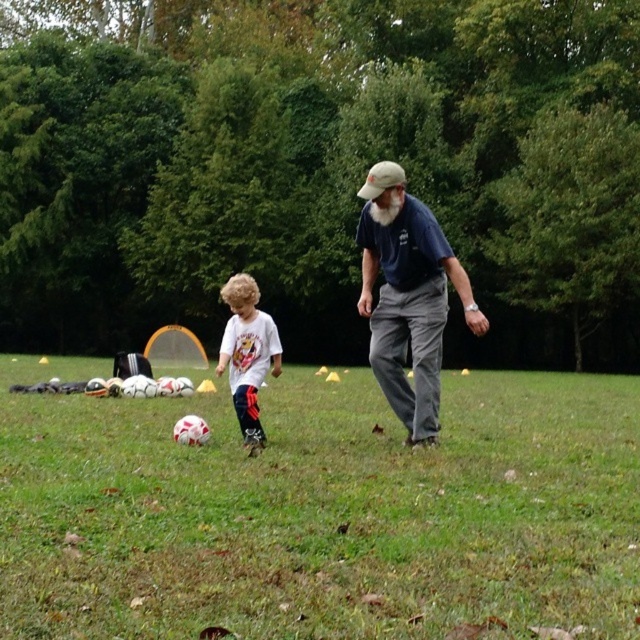
Is green grass at center closer to camera compared to dark blue shirt at center?

Yes, green grass at center is in front of dark blue shirt at center.

Is green grass at center positioned behind dark blue shirt at center?

No, it is not.

Looking at this image, who is more distant from viewer, (17, 358) or (417, 310)?

Positioned behind is point (17, 358).

The width and height of the screenshot is (640, 640). In order to click on green grass at center in this screenshot , I will do pyautogui.click(x=321, y=512).

Is dark blue shirt at center further to the viewer compared to white matte shirt at center?

No, dark blue shirt at center is in front of white matte shirt at center.

Is point (410, 344) behind point (243, 289)?

That is False.

I want to click on dark blue shirt at center, so click(406, 296).

Does point (248, 490) come in front of point (252, 392)?

Yes, it is in front of point (252, 392).

Does green grass at center have a lesser width compared to white matte shirt at center?

In fact, green grass at center might be wider than white matte shirt at center.

Locate an element on the screen. The height and width of the screenshot is (640, 640). green grass at center is located at coordinates (321, 512).

You are a GUI agent. You are given a task and a screenshot of the screen. Output one action in this format:
    pyautogui.click(x=<x>, y=<y>)
    Task: Click on the green grass at center
    
    Given the screenshot: What is the action you would take?
    pyautogui.click(x=321, y=512)